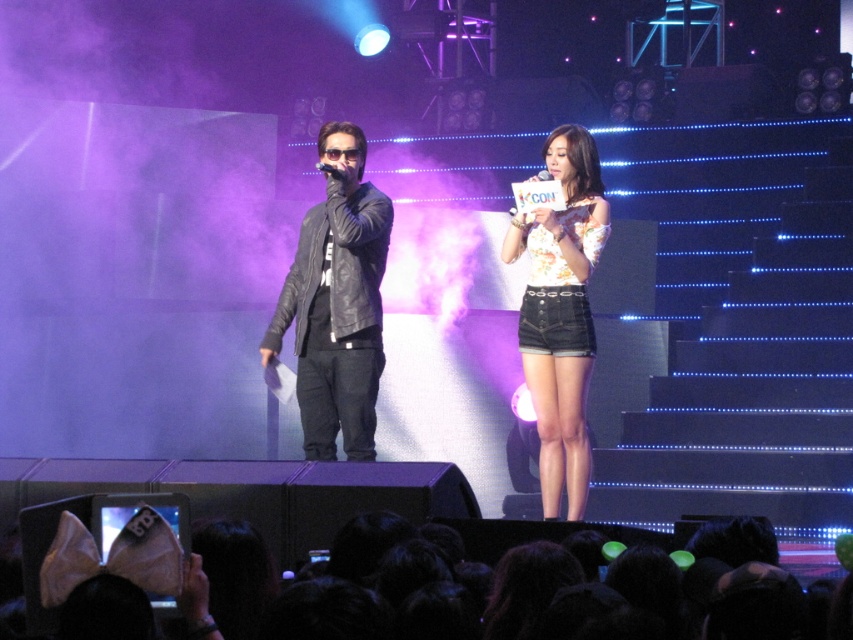
Question: Which of the following is the closest to the observer?

Choices:
 (A) (366, 369)
 (B) (579, 436)
 (C) (546, 170)

Answer: (A)

Question: Which point is closer to the camera?

Choices:
 (A) (550, 179)
 (B) (320, 164)

Answer: (B)

Question: Is black leather microphone at center below matte black microphone at center?

Choices:
 (A) no
 (B) yes

Answer: (B)

Question: Considering the real-world distances, which object is closest to the black leather microphone at center?

Choices:
 (A) matte black microphone at center
 (B) leather jacket at center

Answer: (B)

Question: Is floral fabric top at center to the left of black leather microphone at center from the viewer's perspective?

Choices:
 (A) no
 (B) yes

Answer: (A)

Question: Is floral fabric top at center above black leather microphone at center?

Choices:
 (A) no
 (B) yes

Answer: (A)